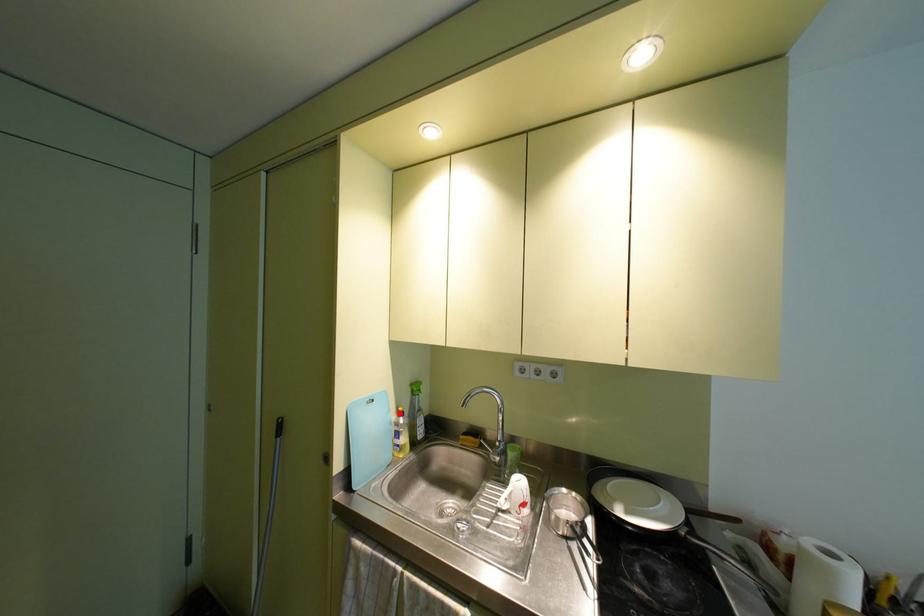
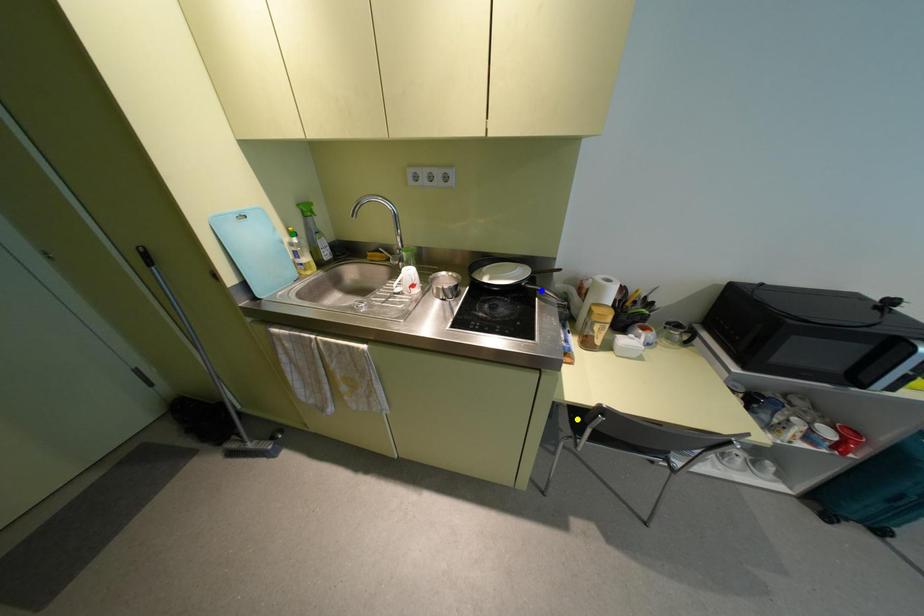
Question: I am providing you with two images of the same scene from different viewpoints. A red point is marked on the first image. You are given multiple points on the second image. Which point in image 2 represents the same 3d spot as the red point in image 1?

Choices:
 (A) blue point
 (B) yellow point
 (C) green point

Answer: (C)